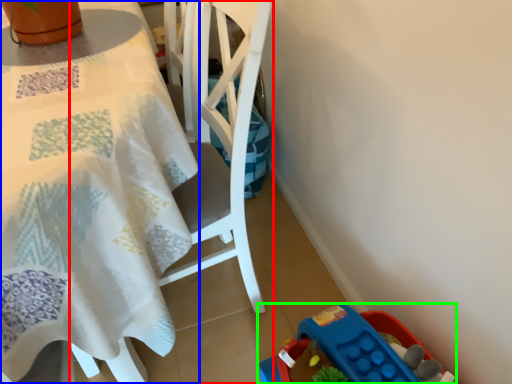
Question: Which is nearer to the chair (highlighted by a red box)? table (highlighted by a blue box) or toy (highlighted by a green box).

Choices:
 (A) table
 (B) toy

Answer: (A)